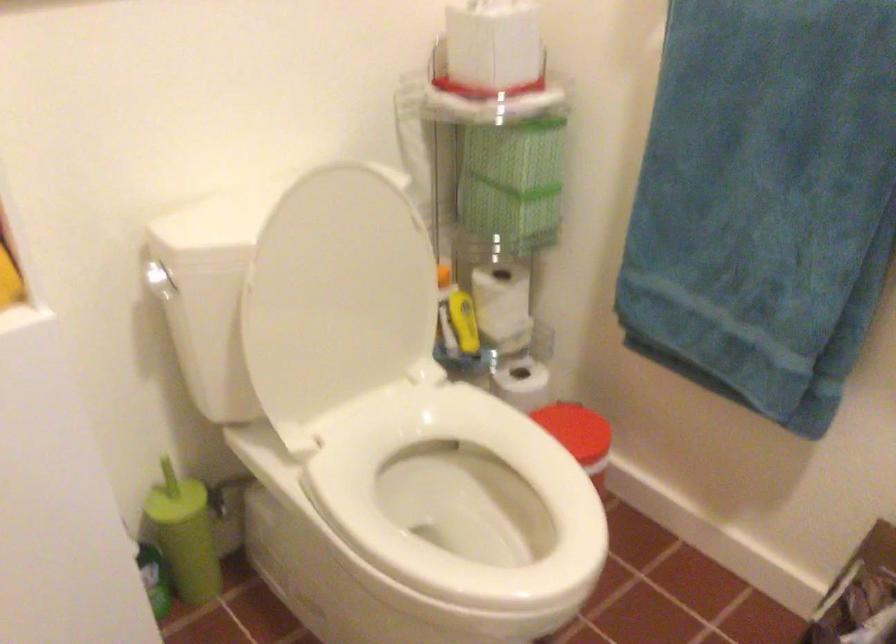
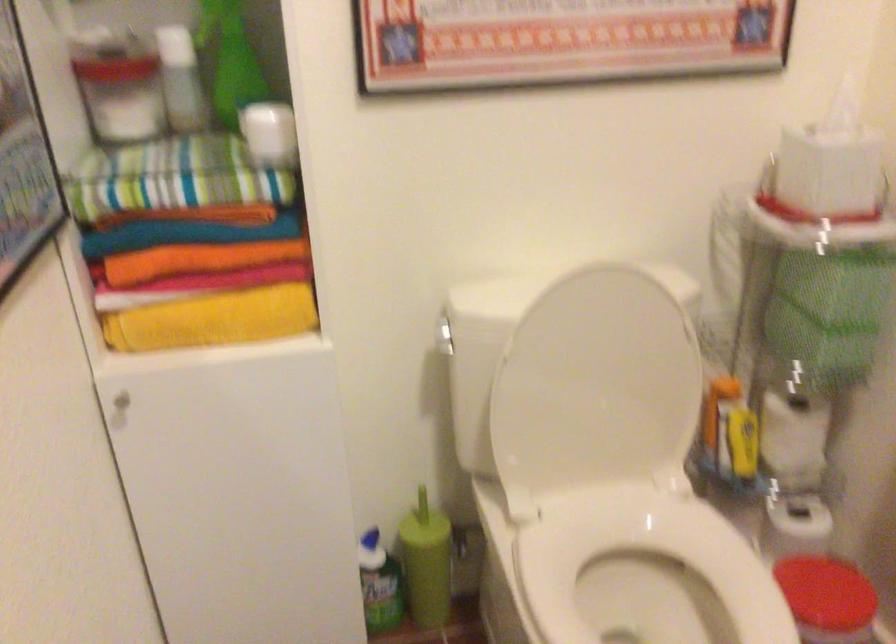
The point at [504,308] is marked in the first image. Where is the corresponding point in the second image?

(793, 440)